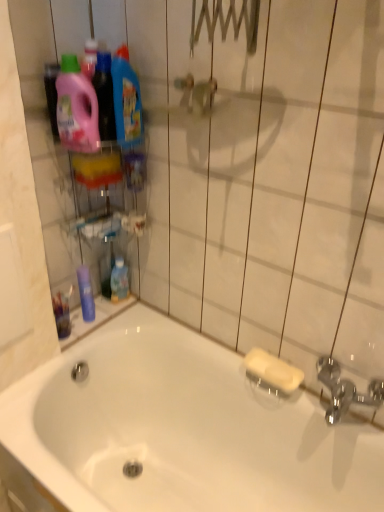
Question: Is blue glossy mouthwash at lower center, which is the 2th mouthwash in left-to-right order, smaller than pink plastic detergent at upper left, the second cleaning product in the right-to-left sequence?

Choices:
 (A) yes
 (B) no

Answer: (A)

Question: Would you say blue glossy mouthwash at lower center, which is the 2th mouthwash in left-to-right order, is outside pink plastic detergent at upper left, the second cleaning product in the right-to-left sequence?

Choices:
 (A) no
 (B) yes

Answer: (B)

Question: Can you confirm if blue glossy mouthwash at lower center, which is the 2th mouthwash in left-to-right order, is wider than pink plastic detergent at upper left, the second cleaning product in the right-to-left sequence?

Choices:
 (A) no
 (B) yes

Answer: (A)

Question: Is blue glossy mouthwash at lower center, which is the 2th mouthwash in left-to-right order, at the right side of pink plastic detergent at upper left, the first cleaning product positioned from the left?

Choices:
 (A) yes
 (B) no

Answer: (A)

Question: Is blue glossy mouthwash at lower center, which is the first mouthwash from right to left, taller than pink plastic detergent at upper left, the second cleaning product in the right-to-left sequence?

Choices:
 (A) no
 (B) yes

Answer: (A)

Question: Is the surface of blue glossy mouthwash at lower center, which is the first mouthwash from right to left, in direct contact with pink plastic detergent at upper left, the first cleaning product positioned from the left?

Choices:
 (A) yes
 (B) no

Answer: (B)

Question: Does white glossy bathtub at lower left have a larger size compared to pink plastic detergent at upper left, the first cleaning product positioned from the left?

Choices:
 (A) no
 (B) yes

Answer: (B)

Question: From the image's perspective, is white glossy bathtub at lower left over pink plastic detergent at upper left, the second cleaning product in the right-to-left sequence?

Choices:
 (A) yes
 (B) no

Answer: (B)

Question: From a real-world perspective, is white glossy bathtub at lower left over pink plastic detergent at upper left, the second cleaning product in the right-to-left sequence?

Choices:
 (A) yes
 (B) no

Answer: (B)

Question: Are white glossy bathtub at lower left and pink plastic detergent at upper left, the second cleaning product in the right-to-left sequence, beside each other?

Choices:
 (A) yes
 (B) no

Answer: (B)

Question: Is white glossy bathtub at lower left to the right of pink plastic detergent at upper left, the second cleaning product in the right-to-left sequence, from the viewer's perspective?

Choices:
 (A) no
 (B) yes

Answer: (B)

Question: Considering the relative sizes of white glossy bathtub at lower left and pink plastic detergent at upper left, the first cleaning product positioned from the left, in the image provided, is white glossy bathtub at lower left smaller than pink plastic detergent at upper left, the first cleaning product positioned from the left,?

Choices:
 (A) no
 (B) yes

Answer: (A)

Question: Is pink plastic detergent at upper left, the first cleaning product positioned from the left, next to blue glossy mouthwash at left, which is the 1th mouthwash from left to right, and touching it?

Choices:
 (A) no
 (B) yes

Answer: (A)